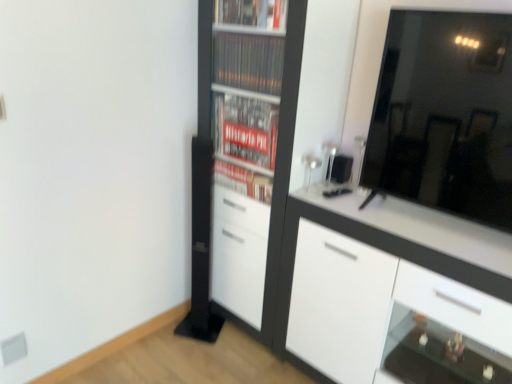
Question: Relative to white glossy cabinet at right, is white matte cupboard at center in front or behind?

Choices:
 (A) behind
 (B) front

Answer: (A)

Question: Considering the positions of point (210, 175) and point (422, 336), is point (210, 175) closer or farther from the camera than point (422, 336)?

Choices:
 (A) farther
 (B) closer

Answer: (A)

Question: Which object is the closest to the black glossy mirror at upper right?

Choices:
 (A) transparent glass shelf at lower right
 (B) white glossy cabinet at right
 (C) white matte cupboard at center

Answer: (B)

Question: Which object is positioned closest to the transparent glass shelf at lower right?

Choices:
 (A) white glossy cabinet at right
 (B) white matte cupboard at center
 (C) black glossy mirror at upper right

Answer: (A)